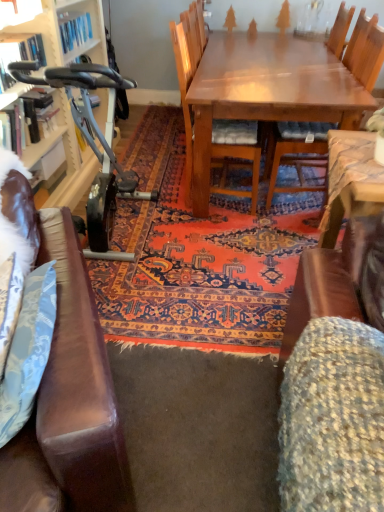
Where is `vacant area that is in front of metallic blue exercise bike at left`? The height and width of the screenshot is (512, 384). vacant area that is in front of metallic blue exercise bike at left is located at coordinates (x=162, y=307).